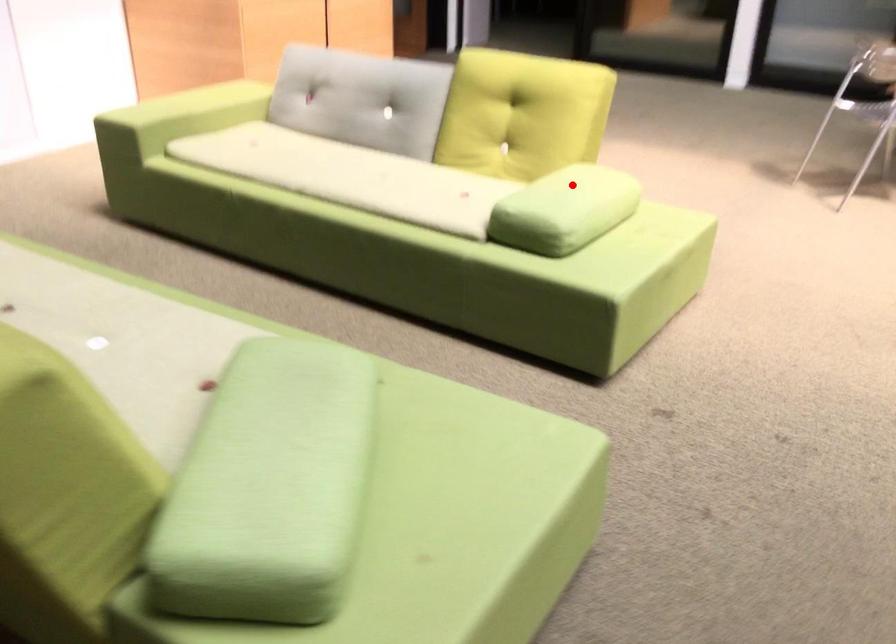
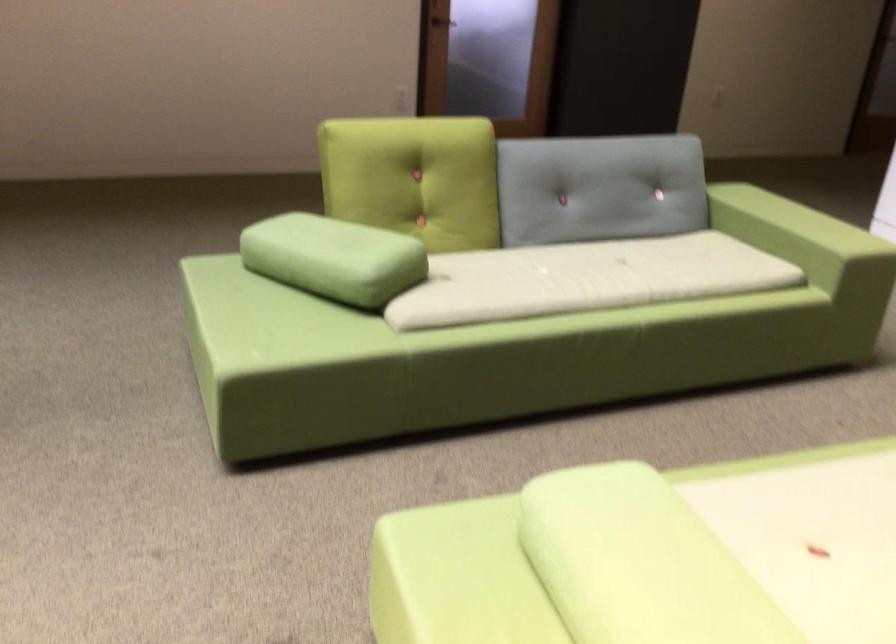
Find the pixel in the second image that matches the highlighted location in the first image.

(651, 556)